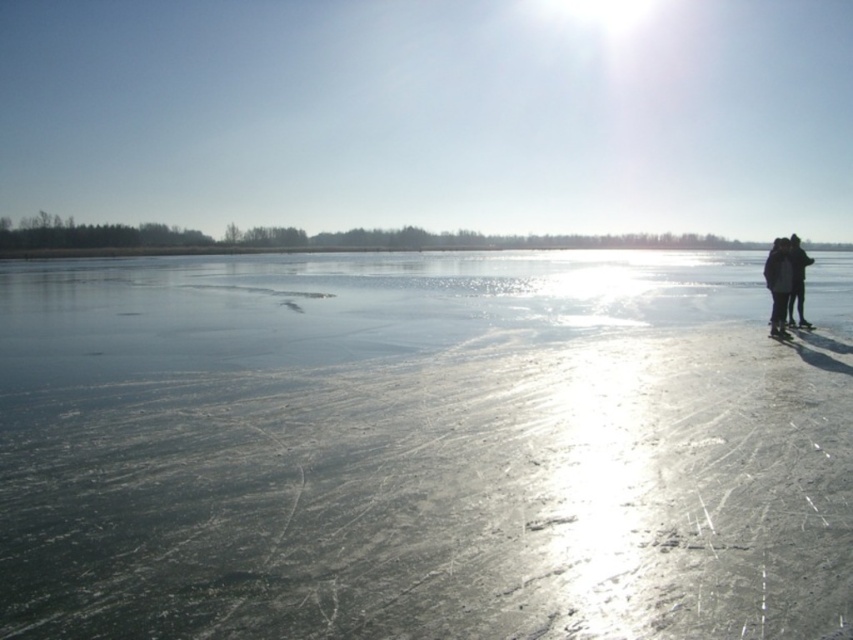
The width and height of the screenshot is (853, 640). What do you see at coordinates (780, 282) in the screenshot? I see `dark gray woolen jackets at right` at bounding box center [780, 282].

Which of these two, dark gray woolen jackets at right or black matte jacket at right, stands taller?

dark gray woolen jackets at right is taller.

Locate an element on the screen. The height and width of the screenshot is (640, 853). dark gray woolen jackets at right is located at coordinates (780, 282).